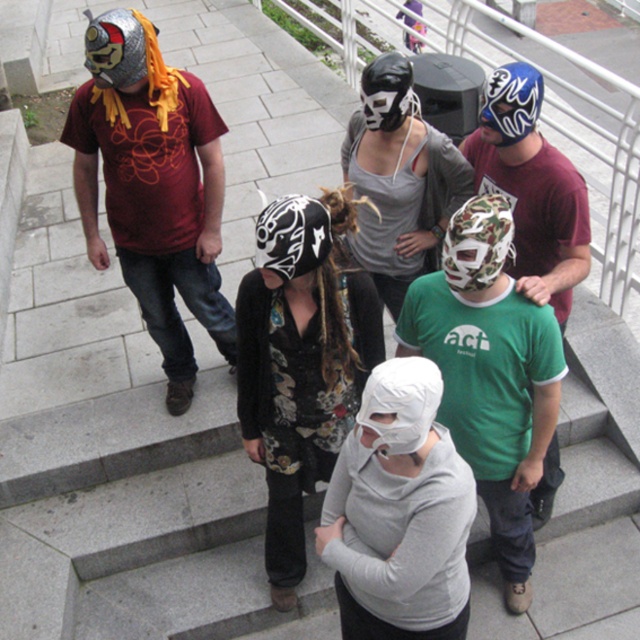
You are standing on the outdoor stairs and want to move from point A to point B. Point A is at coordinates point (129, 112) and point B is at coordinates point (298, 550). Since you can only move forward, which point will you reach first?

You will reach point A at coordinates point (129, 112) first because it is closer to you than point B at coordinates point (298, 550).